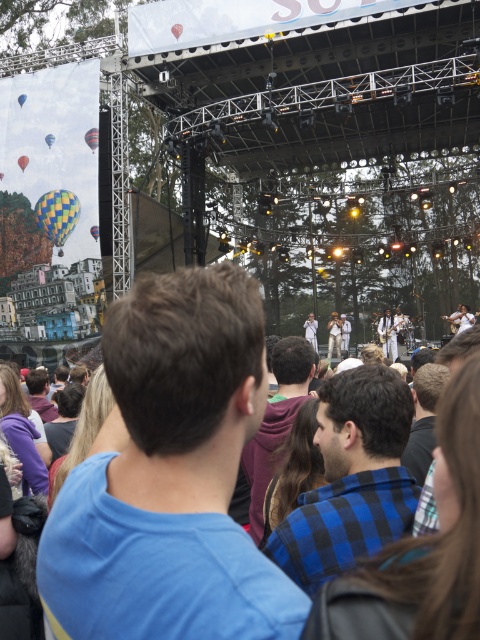
Measure the distance between point (96, 147) and camera.

Point (96, 147) and camera are 71.78 meters apart from each other.

Can you confirm if multicolored fabric hot air balloon at upper left is smaller than checkered fabric hot air balloon at upper left?

No, multicolored fabric hot air balloon at upper left is not smaller than checkered fabric hot air balloon at upper left.

Who is more forward, (90, 141) or (97, 236)?

Point (97, 236) is in front.

I want to click on multicolored fabric hot air balloon at upper left, so click(x=92, y=138).

Is checkered fabric balloon at upper left to the left of checkered fabric hot air balloon at upper left from the viewer's perspective?

Correct, you'll find checkered fabric balloon at upper left to the left of checkered fabric hot air balloon at upper left.

Is checkered fabric balloon at upper left below checkered fabric hot air balloon at upper left?

No.

Identify the location of checkered fabric balloon at upper left. (58, 214).

Does checkered fabric balloon at upper left appear over multicolored fabric hot air balloon at upper left?

No.

Does checkered fabric balloon at upper left have a greater width compared to multicolored fabric hot air balloon at upper left?

No.

Does point (51, 212) come farther from viewer compared to point (85, 136)?

No, it is not.

The width and height of the screenshot is (480, 640). Identify the location of checkered fabric balloon at upper left. 58,214.